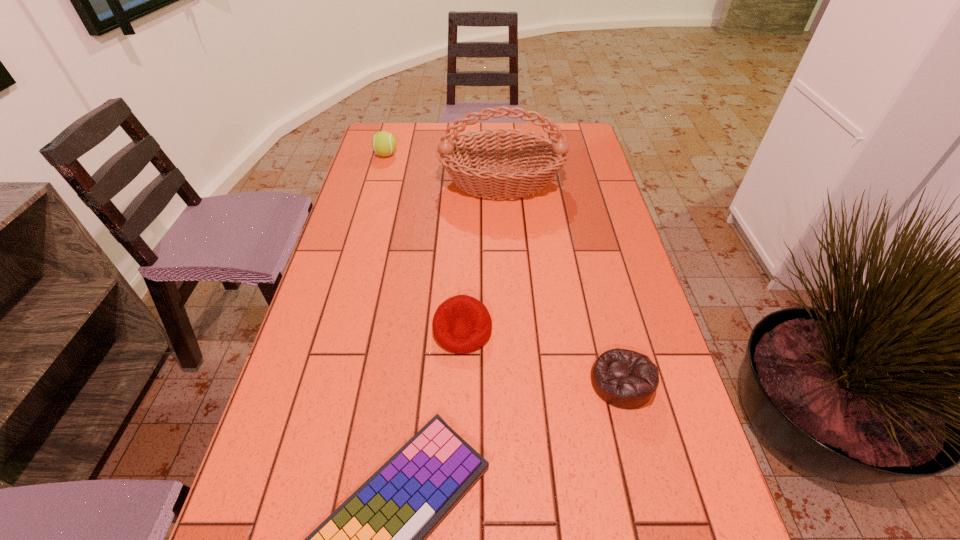
What are the coordinates of `blank region between the second shortest object and the left beanbag` in the screenshot? It's located at (542, 356).

Locate an element on the screen. The width and height of the screenshot is (960, 540). object identified as the third closest to the taller beanbag is located at coordinates (544, 157).

Select which object appears as the third closest to the right beanbag. Please provide its 2D coordinates. Your answer should be formatted as a tuple, i.e. [(x, y)], where the tuple contains the x and y coordinates of a point satisfying the conditions above.

[(544, 157)]

This screenshot has height=540, width=960. Identify the location of vacant space that satisfies the following two spatial constraints: 1. on the front side of the tennis ball; 2. on the left side of the fourth tallest object. (323, 381).

I want to click on free spot that satisfies the following two spatial constraints: 1. on the seat area of the shorter beanbag; 2. on the left side of the taller beanbag, so click(461, 381).